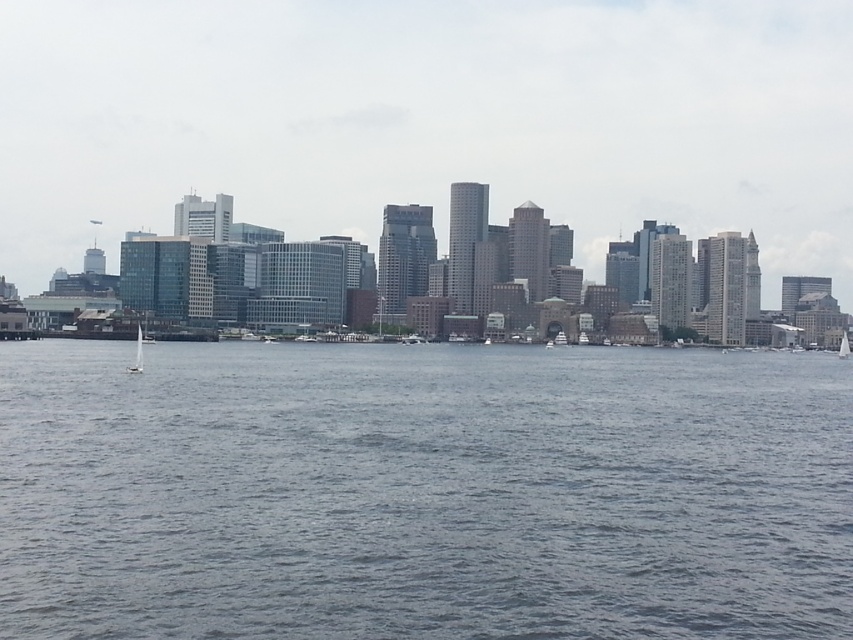
You are standing on a pier and see two boats in the water. The white glossy sailboat at lower left and the white sailboat at right. Which boat is closer to the horizon?

The white sailboat at right is closer to the horizon because the white glossy sailboat at lower left is above it, indicating it is positioned in front and thus closer to the viewer.

In the scene shown: You are a photographer standing on the dock and want to capture both the gray water at center and the white glossy sailboat at lower left in a single shot. Based on their positions, can you fit both into your camera frame without moving your position?

The gray water at center might be wider than white glossy sailboat at lower left, so there is a possibility that both can be captured in a single shot depending on the camera lens used.

You are a photographer standing at the center of a dock, aiming to capture the white glossy sailboat at lower left in your shot. Based on its coordinates, where should you position your camera to ensure the sailboat is centered in the frame?

The white glossy sailboat at lower left is located at coordinates point (137, 353), so to center it in the frame, the photographer should position the camera so that the boat is at the center point of the image.